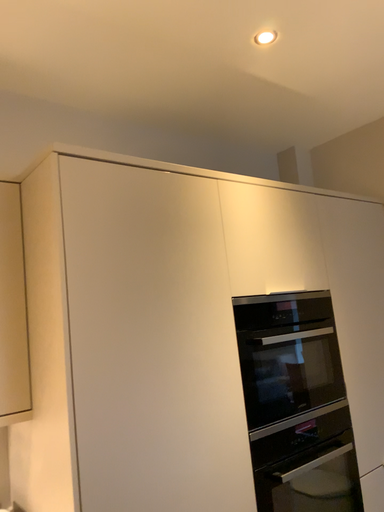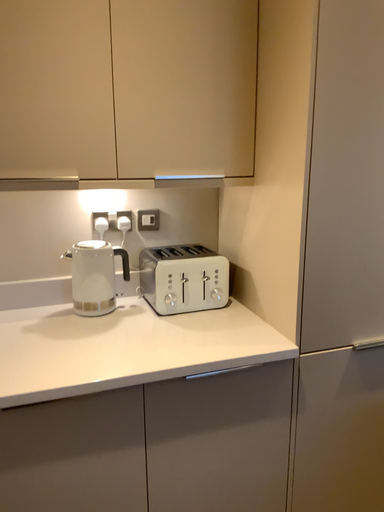
Question: How did the camera likely rotate when shooting the video?

Choices:
 (A) rotated right
 (B) rotated left

Answer: (B)